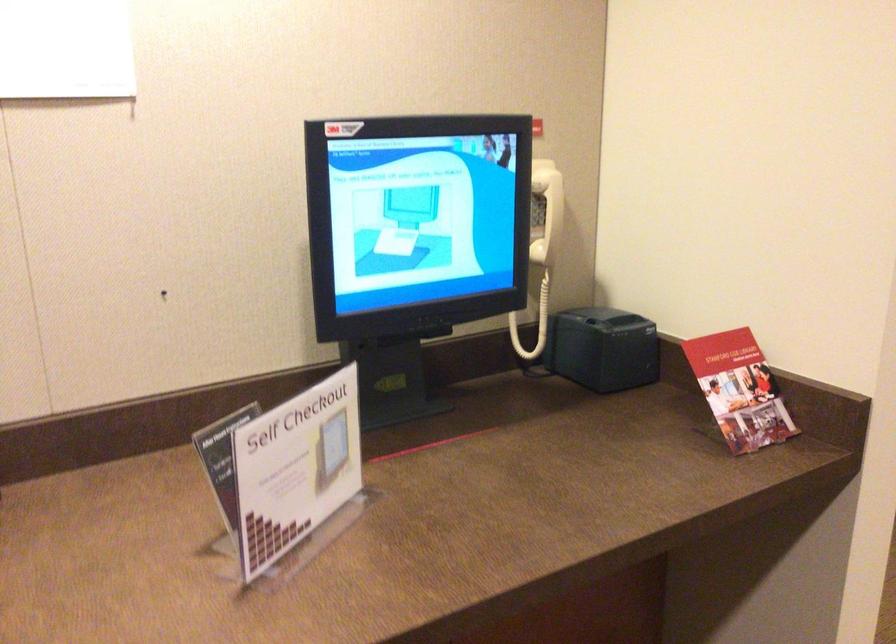
What do you see at coordinates (547, 211) in the screenshot? This screenshot has height=644, width=896. I see `the white telephone handset` at bounding box center [547, 211].